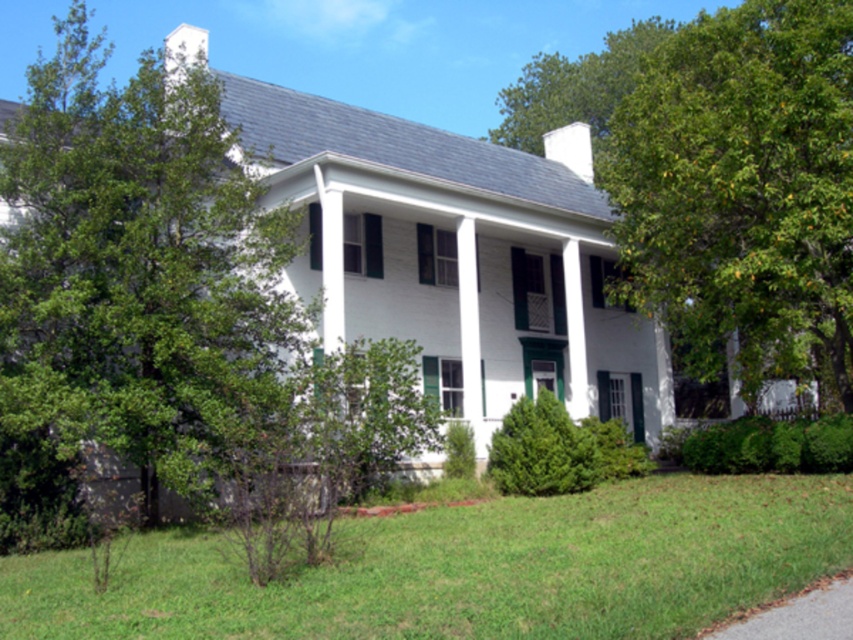
Question: Can you confirm if green grass at lower center is bigger than green leafy tree at right?

Choices:
 (A) no
 (B) yes

Answer: (A)

Question: Which point is farther from the camera taking this photo?

Choices:
 (A) coord(589,502)
 (B) coord(62,420)

Answer: (A)

Question: Estimate the real-world distances between objects in this image. Which object is closer to the green grass at lower center?

Choices:
 (A) green leafy tree at right
 (B) green leafy tree at left

Answer: (A)

Question: Which of the following is the farthest from the observer?

Choices:
 (A) (122, 314)
 (B) (619, 563)
 (C) (744, 192)

Answer: (C)

Question: Can you confirm if green grass at lower center is positioned below green leafy tree at right?

Choices:
 (A) yes
 (B) no

Answer: (A)

Question: Can you confirm if green leafy tree at left is smaller than green leafy tree at right?

Choices:
 (A) no
 (B) yes

Answer: (A)